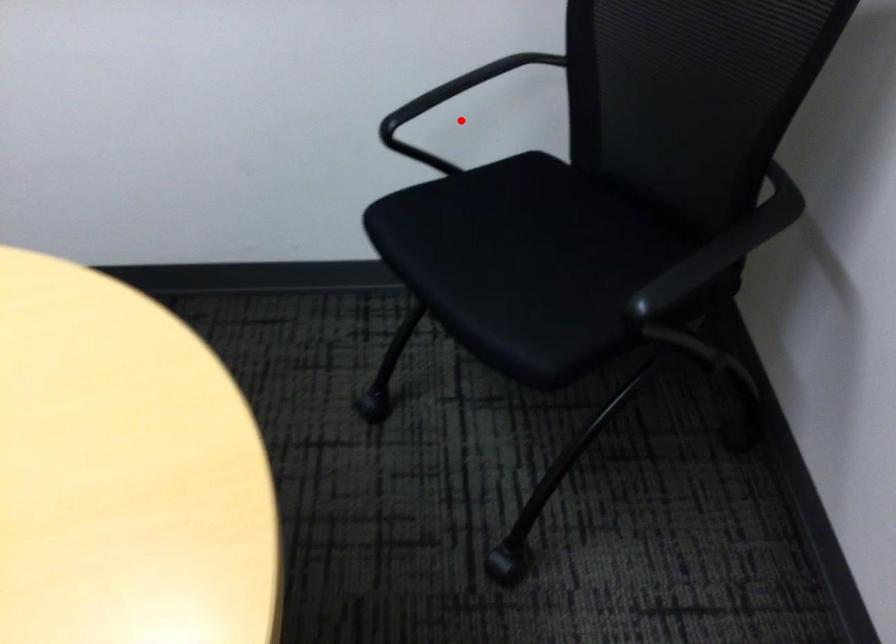
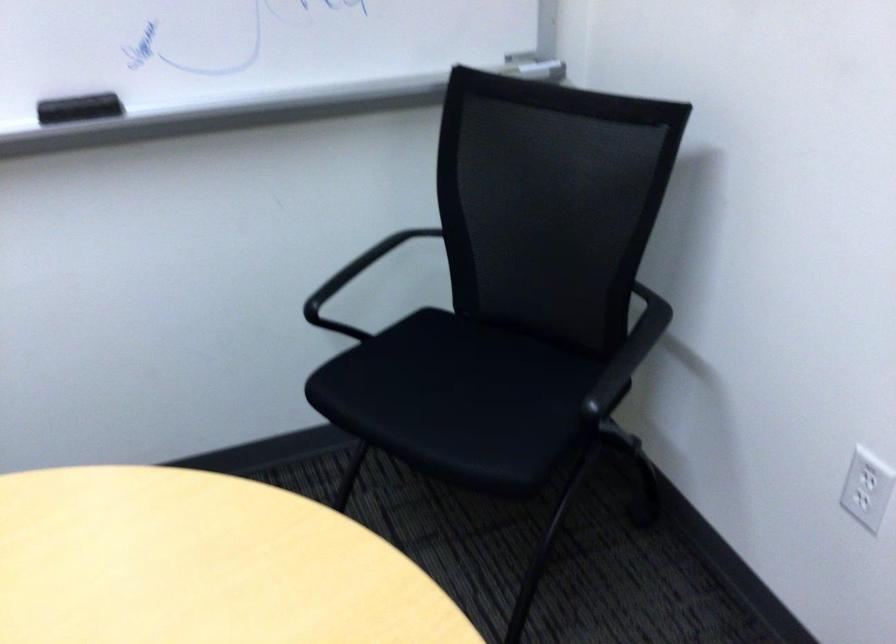
In the second image, find the point that corresponds to the highlighted location in the first image.

(341, 290)